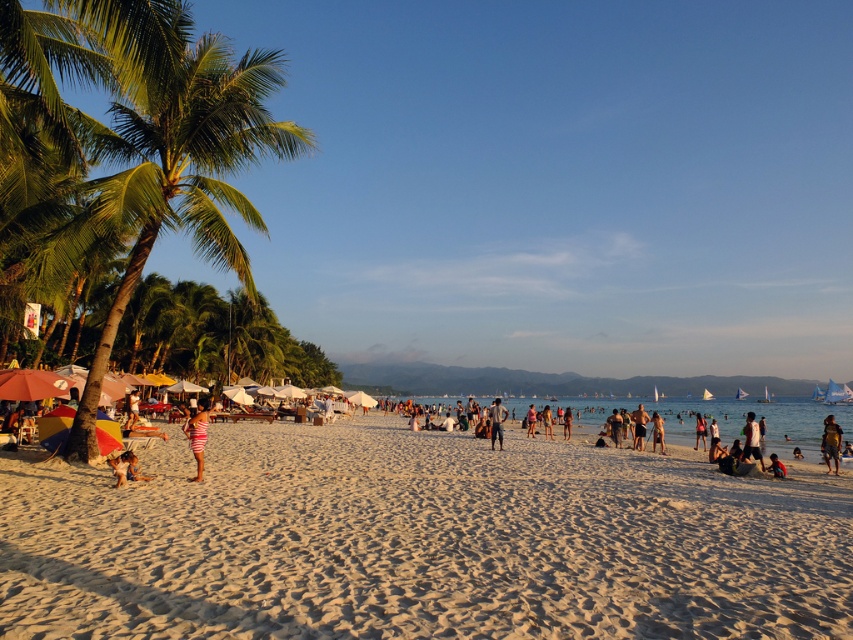
You are a photographer planning to take a picture of the striped fabric swimsuit at center and the sandy beach at lower center. Which object should you focus on first if you want to capture both in a single frame without moving the camera? Explain your reasoning based on their sizes.

The sandy beach at lower center is wider than the striped fabric swimsuit at center. Since the sandy beach at lower center has a greater width, it would occupy more space in the frame. To ensure both are captured, focus on centering the wider sandy beach at lower center first, then adjust the composition to include the smaller striped fabric swimsuit at center.

You are a photographer standing at the edge of the beach, and you want to capture a photo of both the striped fabric swimsuit at center and the tan skin person at center in the same frame. Given that your camera has a maximum zoom range of 10 meters, can you fit both subjects into the photo without moving closer?

The striped fabric swimsuit at center and tan skin person at center are 23.72 meters apart, which exceeds the camera maximum zoom range of 10 meters. Therefore, you cannot fit both subjects into the photo without moving closer.

Based on the photo, you are standing at the beach looking towards the palm trees. There are two points marked on the sand. The first point is at coordinate (202, 422) and the second point is at coordinate (643, 436). Which point is closer to your current position?

Point (202, 422) is closer to the camera than point (643, 436), so the first point is closer to your current position.